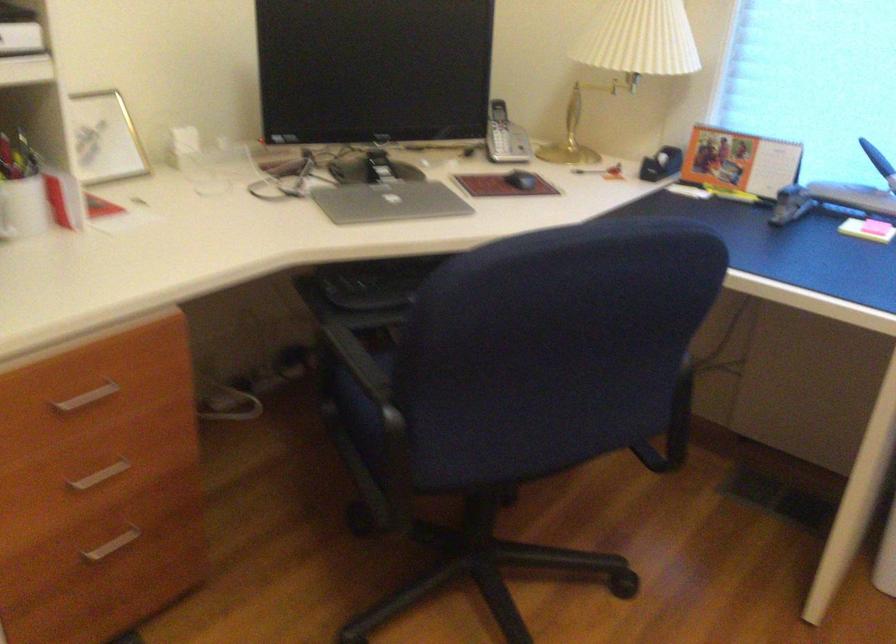
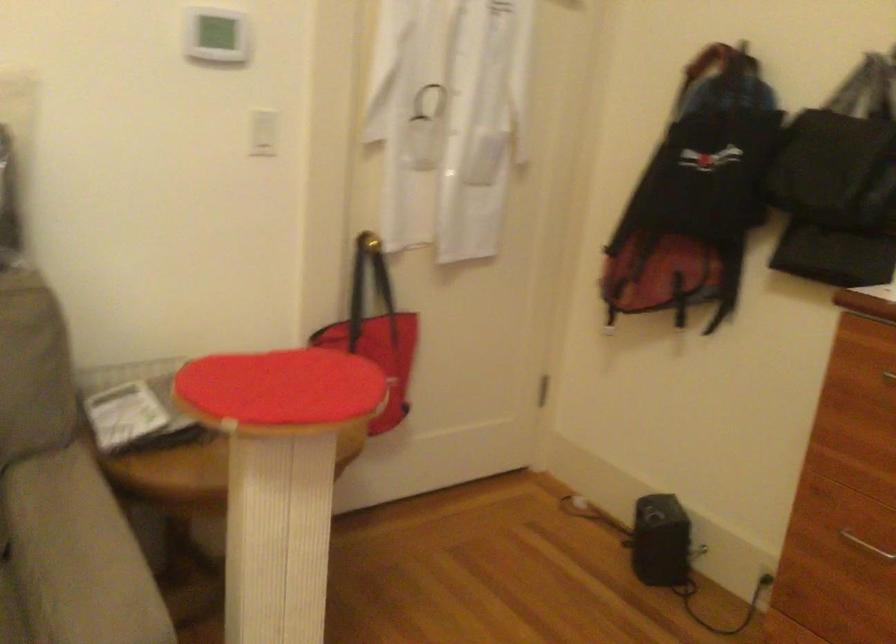
First-person continuous shooting, in which direction is the camera rotating?

The camera's rotation is toward left-down.